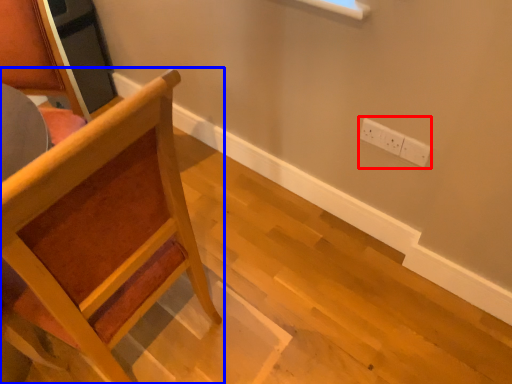
Question: Among these objects, which one is farthest to the camera, electric outlet (highlighted by a red box) or chair (highlighted by a blue box)?

Choices:
 (A) electric outlet
 (B) chair

Answer: (A)